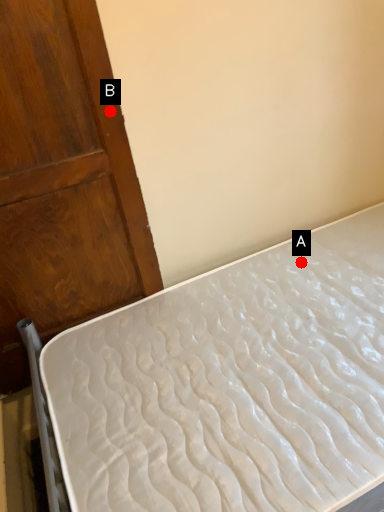
Question: Two points are circled on the image, labeled by A and B beside each circle. Which point appears farthest from the camera in this image?

Choices:
 (A) A is further
 (B) B is further

Answer: (A)